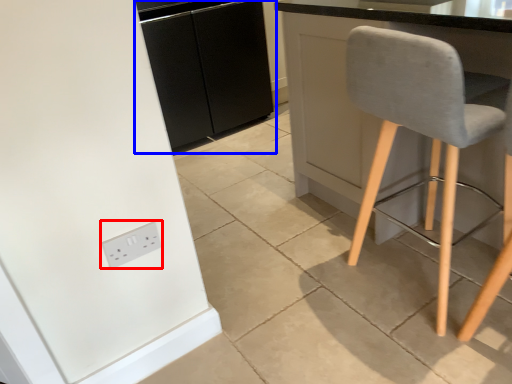
Question: Which object appears closest to the camera in this image, socket (highlighted by a red box) or cabinetry (highlighted by a blue box)?

Choices:
 (A) socket
 (B) cabinetry

Answer: (A)